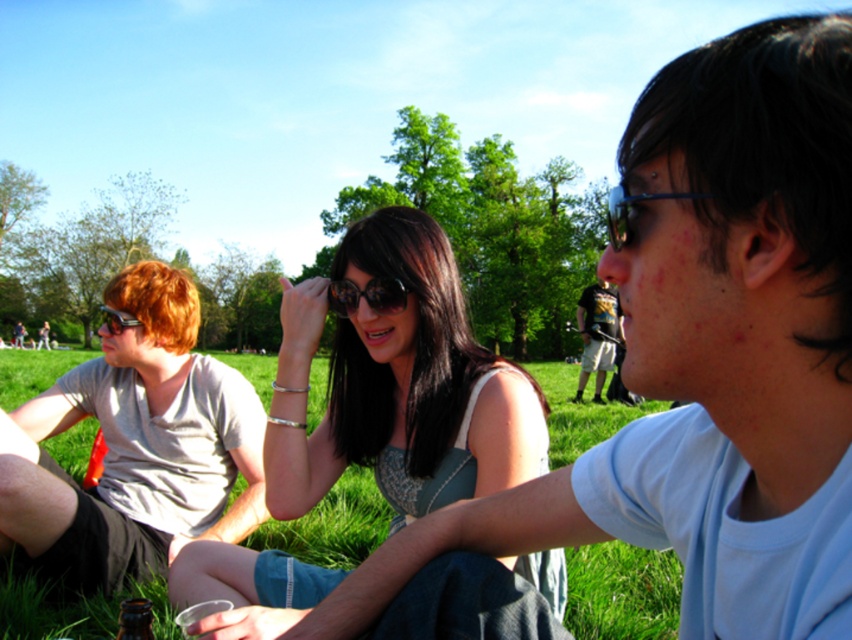
Question: Which object is positioned closest to the matte gray t-shirt at left?

Choices:
 (A) matte black sunglasses at center
 (B) brown glass bottle at lower left
 (C) black reflective sunglasses at center

Answer: (A)

Question: Among these objects, which one is farthest from the camera?

Choices:
 (A) black reflective sunglasses at center
 (B) green grass at center
 (C) matte black sunglasses at center

Answer: (B)

Question: Is matte gray t-shirt at left to the right of dark blue jeans at center from the viewer's perspective?

Choices:
 (A) no
 (B) yes

Answer: (A)

Question: Which object is the closest to the brown glass bottle at lower left?

Choices:
 (A) matte black sunglasses at center
 (B) black reflective sunglasses at center

Answer: (A)

Question: Does dark blue jeans at center appear over brown glass bottle at lower left?

Choices:
 (A) yes
 (B) no

Answer: (A)

Question: Does matte black sunglasses at center have a smaller size compared to dark blue jeans at center?

Choices:
 (A) no
 (B) yes

Answer: (A)